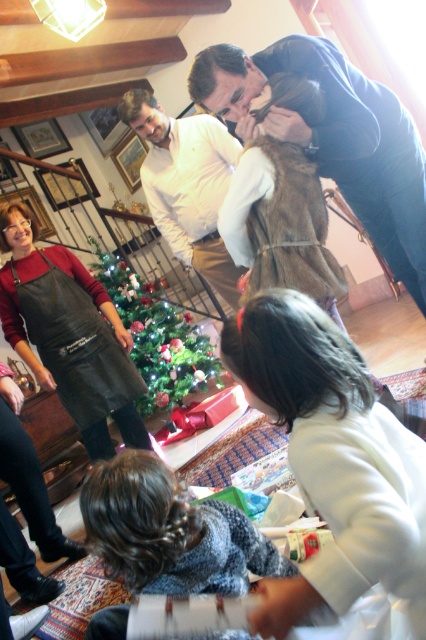
Question: Does dark blue sweater at upper center come in front of green shiny christmas tree at center?

Choices:
 (A) yes
 (B) no

Answer: (A)

Question: Which object is closer to the camera taking this photo?

Choices:
 (A) green shiny christmas tree at center
 (B) brown fur vest at center
 (C) white matte jacket at lower right

Answer: (C)

Question: Does white matte jacket at lower right appear on the left side of dark blue sweater at upper center?

Choices:
 (A) yes
 (B) no

Answer: (A)

Question: Which is farther from the black leather apron at left?

Choices:
 (A) white matte jacket at lower right
 (B) knitted sweater at lower center

Answer: (A)

Question: Which object is closer to the camera taking this photo?

Choices:
 (A) knitted sweater at lower center
 (B) dark blue sweater at upper center
 (C) white shirt at upper center
 (D) white matte jacket at lower right

Answer: (D)

Question: Does white matte jacket at lower right lie behind dark blue sweater at upper center?

Choices:
 (A) yes
 (B) no

Answer: (B)